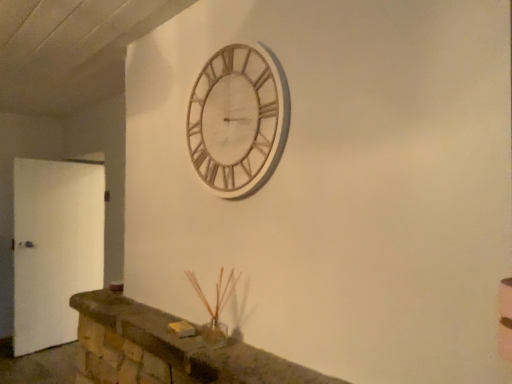
Question: Should I look upward or downward to see wooden clock at upper center?

Choices:
 (A) up
 (B) down

Answer: (A)

Question: Can you confirm if brown stone mantle at lower center is bigger than white matte door at left?

Choices:
 (A) no
 (B) yes

Answer: (A)

Question: Does brown stone mantle at lower center appear on the right side of white matte door at left?

Choices:
 (A) yes
 (B) no

Answer: (A)

Question: Is brown stone mantle at lower center thinner than white matte door at left?

Choices:
 (A) no
 (B) yes

Answer: (A)

Question: Is brown stone mantle at lower center oriented away from white matte door at left?

Choices:
 (A) no
 (B) yes

Answer: (A)

Question: Is brown stone mantle at lower center taller than white matte door at left?

Choices:
 (A) yes
 (B) no

Answer: (B)

Question: Is white matte door at left inside brown stone mantle at lower center?

Choices:
 (A) no
 (B) yes

Answer: (A)

Question: Could you tell me if brown stone mantle at lower center is facing wooden clock at upper center?

Choices:
 (A) yes
 (B) no

Answer: (B)

Question: Does brown stone mantle at lower center appear on the right side of wooden clock at upper center?

Choices:
 (A) yes
 (B) no

Answer: (B)

Question: Is brown stone mantle at lower center positioned behind wooden clock at upper center?

Choices:
 (A) yes
 (B) no

Answer: (B)

Question: Does brown stone mantle at lower center have a greater width compared to wooden clock at upper center?

Choices:
 (A) no
 (B) yes

Answer: (B)

Question: Considering the relative sizes of brown stone mantle at lower center and wooden clock at upper center in the image provided, is brown stone mantle at lower center bigger than wooden clock at upper center?

Choices:
 (A) yes
 (B) no

Answer: (A)

Question: Is brown stone mantle at lower center thinner than wooden clock at upper center?

Choices:
 (A) no
 (B) yes

Answer: (A)

Question: Considering the relative sizes of white matte door at left and brown stone mantle at lower center in the image provided, is white matte door at left shorter than brown stone mantle at lower center?

Choices:
 (A) yes
 (B) no

Answer: (B)